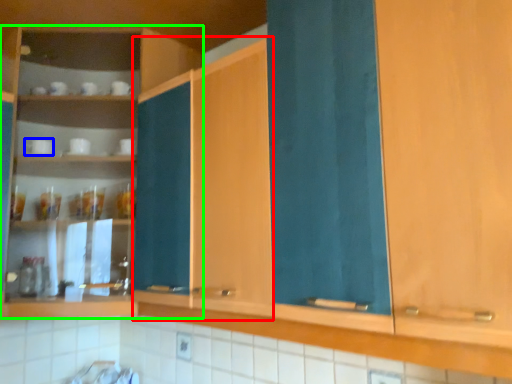
Question: Considering the real-world distances, which object is closest to cabinetry (highlighted by a red box)? tableware (highlighted by a blue box) or cabinetry (highlighted by a green box).

Choices:
 (A) tableware
 (B) cabinetry

Answer: (B)